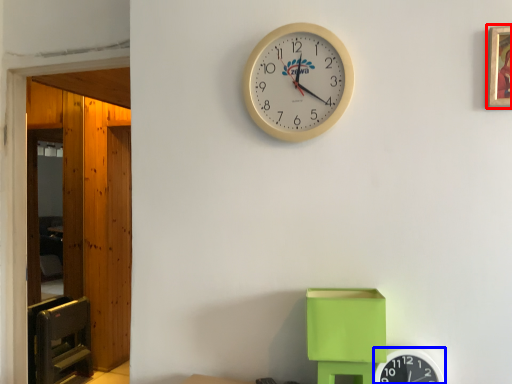
Question: Which point is further to the camera, picture frame (highlighted by a red box) or wall clock (highlighted by a blue box)?

Choices:
 (A) picture frame
 (B) wall clock

Answer: (B)